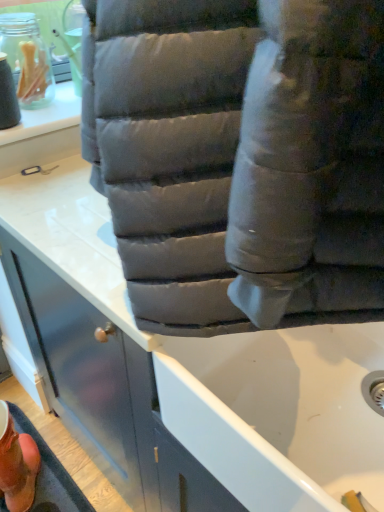
The height and width of the screenshot is (512, 384). What do you see at coordinates (278, 413) in the screenshot?
I see `matte gray cushion at lower center` at bounding box center [278, 413].

I want to click on matte gray cushion at lower center, so click(x=278, y=413).

What do you see at coordinates (17, 464) in the screenshot? I see `orange suede boot at lower left` at bounding box center [17, 464].

Locate an element on the screen. The width and height of the screenshot is (384, 512). orange suede boot at lower left is located at coordinates (17, 464).

Find the location of a particular element. matte gray cushion at lower center is located at coordinates (278, 413).

Would you say matte gray cushion at lower center is to the left or to the right of orange suede boot at lower left in the picture?

In the image, matte gray cushion at lower center appears on the right side of orange suede boot at lower left.

Is matte gray cushion at lower center further to the viewer compared to orange suede boot at lower left?

No, the depth of matte gray cushion at lower center is less than that of orange suede boot at lower left.

Between point (211, 445) and point (16, 432), which one is positioned in front?

The point (211, 445) is closer.

In the scene shown: From the image's perspective, is matte gray cushion at lower center above or below orange suede boot at lower left?

matte gray cushion at lower center is situated higher than orange suede boot at lower left in the image.

From a real-world perspective, who is located higher, matte gray cushion at lower center or orange suede boot at lower left?

matte gray cushion at lower center, from a real-world perspective.

Is matte gray cushion at lower center wider than orange suede boot at lower left?

No.

Considering the relative sizes of matte gray cushion at lower center and orange suede boot at lower left in the image provided, is matte gray cushion at lower center taller than orange suede boot at lower left?

No.

Which of these two, matte gray cushion at lower center or orange suede boot at lower left, is bigger?

matte gray cushion at lower center.

Do you think matte gray cushion at lower center is within orange suede boot at lower left, or outside of it?

matte gray cushion at lower center is outside orange suede boot at lower left.

From the picture: Is matte gray cushion at lower center far away from orange suede boot at lower left?

No, matte gray cushion at lower center is in close proximity to orange suede boot at lower left.

Is matte gray cushion at lower center oriented away from orange suede boot at lower left?

No, orange suede boot at lower left is not at the back of matte gray cushion at lower center.

What are the coordinates of `footwear below the matte gray cushion at lower center (from a real-world perspective)` in the screenshot? It's located at (17, 464).

Considering the positions of objects orange suede boot at lower left and matte gray cushion at lower center in the image provided, who is more to the left, orange suede boot at lower left or matte gray cushion at lower center?

orange suede boot at lower left is more to the left.

Considering their positions, is orange suede boot at lower left located in front of or behind matte gray cushion at lower center?

In the image, orange suede boot at lower left appears behind matte gray cushion at lower center.

Is point (33, 442) closer to camera compared to point (370, 441)?

No, (33, 442) is further to viewer.

From the image's perspective, is orange suede boot at lower left below matte gray cushion at lower center?

Yes, from the image's perspective, orange suede boot at lower left is beneath matte gray cushion at lower center.

Based on the photo, from a real-world perspective, is orange suede boot at lower left positioned above or below matte gray cushion at lower center?

orange suede boot at lower left is below matte gray cushion at lower center.

Is orange suede boot at lower left wider or thinner than matte gray cushion at lower center?

Clearly, orange suede boot at lower left has more width compared to matte gray cushion at lower center.

Considering the relative sizes of orange suede boot at lower left and matte gray cushion at lower center in the image provided, is orange suede boot at lower left taller than matte gray cushion at lower center?

Indeed, orange suede boot at lower left has a greater height compared to matte gray cushion at lower center.

Based on their sizes in the image, would you say orange suede boot at lower left is bigger or smaller than matte gray cushion at lower center?

Considering their sizes, orange suede boot at lower left takes up less space than matte gray cushion at lower center.

Is orange suede boot at lower left situated inside matte gray cushion at lower center or outside?

orange suede boot at lower left is spatially situated outside matte gray cushion at lower center.

Consider the image. Is orange suede boot at lower left not near matte gray cushion at lower center?

No, there isn't a large distance between orange suede boot at lower left and matte gray cushion at lower center.

Is orange suede boot at lower left facing away from matte gray cushion at lower center?

No.

This screenshot has height=512, width=384. What are the coordinates of `footwear that is under the matte gray cushion at lower center (from a real-world perspective)` in the screenshot? It's located at (17, 464).

Image resolution: width=384 pixels, height=512 pixels. I want to click on footwear below the matte gray cushion at lower center (from a real-world perspective), so click(x=17, y=464).

Locate an element on the screen. bath on the right of orange suede boot at lower left is located at coordinates (278, 413).